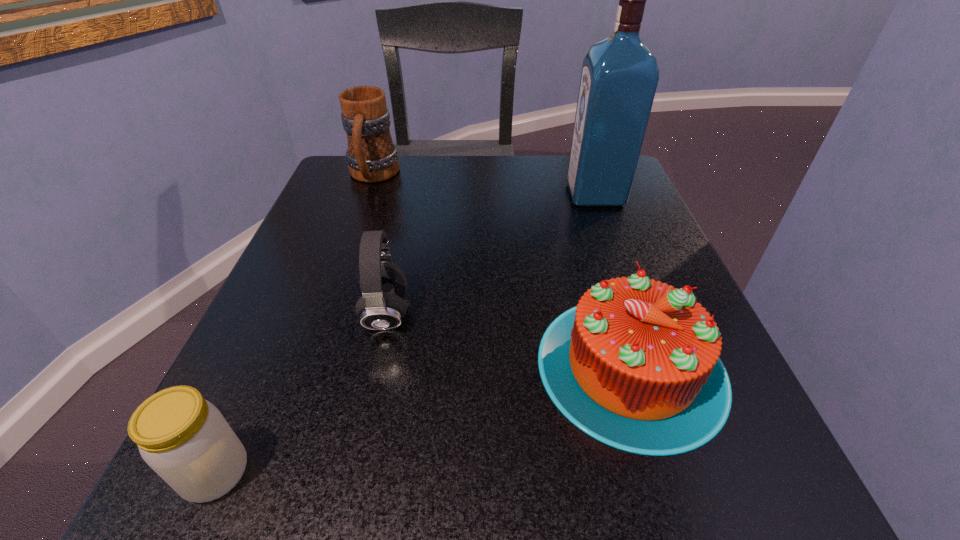
You are a GUI agent. You are given a task and a screenshot of the screen. Output one action in this format:
    pyautogui.click(x=<x>, y=<y>)
    Task: Click on the free spot that satisfies the following two spatial constraints: 1. on the side of the cake with the handle; 2. on the right side of the second tallest object
    Image resolution: width=960 pixels, height=540 pixels.
    Given the screenshot: What is the action you would take?
    304,366

The height and width of the screenshot is (540, 960). I want to click on vacant space that satisfies the following two spatial constraints: 1. on the ear cups of the third object from left to right; 2. on the right side of the cake, so click(x=374, y=366).

The width and height of the screenshot is (960, 540). What are the coordinates of `free space in the image that satisfies the following two spatial constraints: 1. on the flat label side of the tallest object; 2. on the front side of the cake` in the screenshot? It's located at (658, 366).